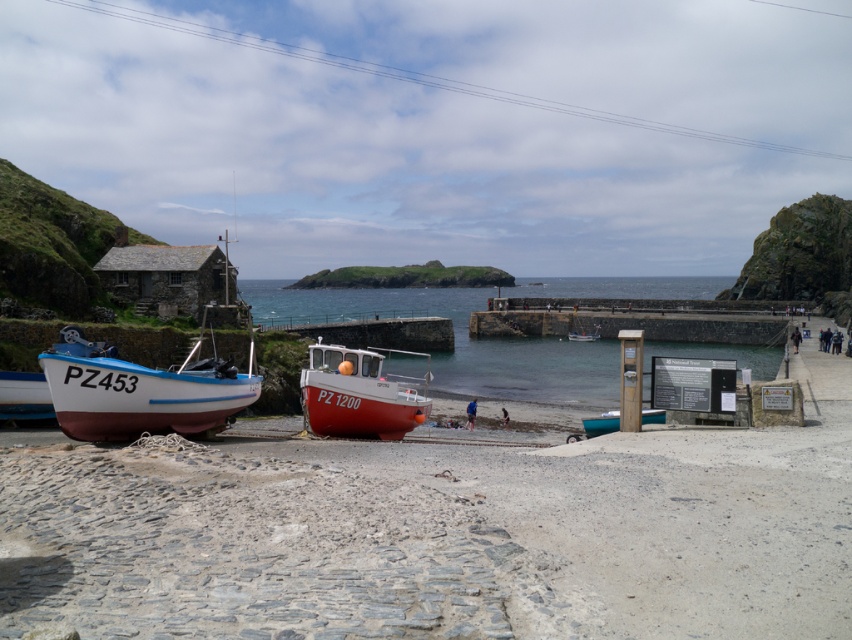
Between white matte boat at lower left and white wooden boat at left, which one is positioned lower?

white wooden boat at left

Measure the distance between white matte boat at lower left and camera.

white matte boat at lower left and camera are 15.27 meters apart from each other.

The image size is (852, 640). Find the location of `white matte boat at lower left`. white matte boat at lower left is located at coordinates (137, 397).

Is white wooden boat at left further to camera compared to teal matte canoe at center?

That is True.

Measure the distance between white wooden boat at left and camera.

white wooden boat at left is 68.13 feet away from camera.

Where is `white wooden boat at left`? The image size is (852, 640). white wooden boat at left is located at coordinates (24, 396).

Based on the photo, measure the distance between clear blue water at center and white matte boat at center.

clear blue water at center and white matte boat at center are 119.30 meters apart.

Who is more forward, (459,388) or (574,340)?

Point (459,388)

Between point (475, 374) and point (591, 337), which one is positioned behind?

Point (591, 337)

Find the location of a particular element. This screenshot has width=852, height=640. clear blue water at center is located at coordinates pos(458,340).